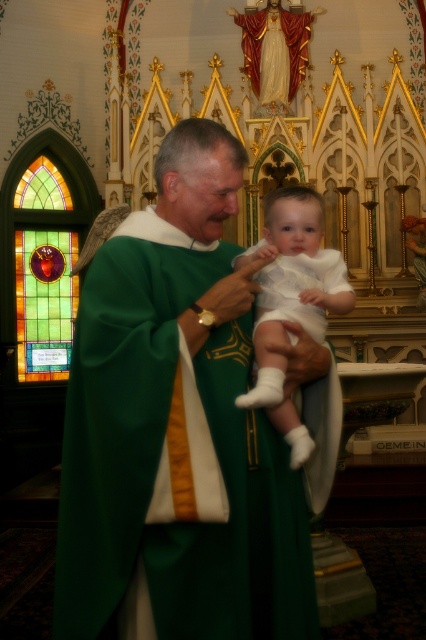
The priest and the white smooth fabric baby at center are standing in the church. How far apart are they?

The priest and the white smooth fabric baby at center are 84.78 feet apart.

What object is located at the coordinates point [172,460] in the church scene?

The point [172,460] corresponds to the green satin robe at center.

You are a photographer standing in the church and want to take a photo of the green satin robe at center and the white smooth fabric baby at center. Which object should you focus on first if you want to capture the one closer to the camera?

The green satin robe at center is positioned on the left side of white smooth fabric baby at center, so the photographer should focus on the green satin robe at center first since it is closer to the camera.